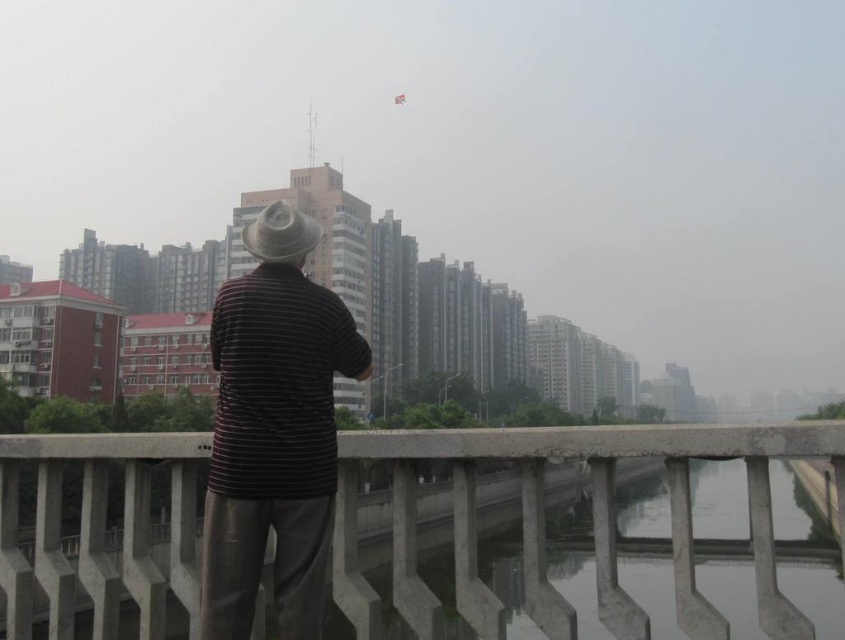
Question: Does concrete bridge at center appear under striped cotton shirt at center?

Choices:
 (A) yes
 (B) no

Answer: (A)

Question: Among these points, which one is farthest from the camera?

Choices:
 (A) (766, 433)
 (B) (289, 266)

Answer: (B)

Question: Is concrete bridge at center thinner than striped cotton shirt at center?

Choices:
 (A) yes
 (B) no

Answer: (B)

Question: Is concrete bridge at center to the left of striped cotton shirt at center from the viewer's perspective?

Choices:
 (A) yes
 (B) no

Answer: (B)

Question: Which point is closer to the camera?

Choices:
 (A) striped cotton shirt at center
 (B) concrete bridge at center

Answer: (B)